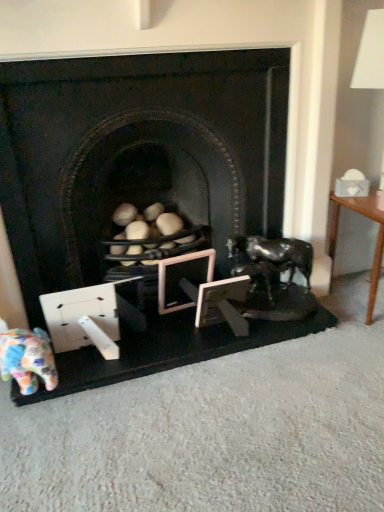
Question: From the image's perspective, is wooden picture frame at center, the 1th picture frame in the left-to-right sequence, beneath multicolored fabric elephant at lower left?

Choices:
 (A) no
 (B) yes

Answer: (A)

Question: Can you confirm if wooden picture frame at center, marked as the 2th picture frame in a right-to-left arrangement, is wider than multicolored fabric elephant at lower left?

Choices:
 (A) yes
 (B) no

Answer: (B)

Question: From a real-world perspective, is wooden picture frame at center, the 1th picture frame in the left-to-right sequence, positioned under multicolored fabric elephant at lower left based on gravity?

Choices:
 (A) no
 (B) yes

Answer: (A)

Question: Can multicolored fabric elephant at lower left be found inside wooden picture frame at center, the 1th picture frame in the left-to-right sequence?

Choices:
 (A) no
 (B) yes

Answer: (A)

Question: From a real-world perspective, is wooden picture frame at center, the 1th picture frame in the left-to-right sequence, over multicolored fabric elephant at lower left?

Choices:
 (A) yes
 (B) no

Answer: (A)

Question: From the image's perspective, is wooden picture frame at center, arranged as the first picture frame when viewed from the right, located above or below multicolored fabric elephant at lower left?

Choices:
 (A) above
 (B) below

Answer: (A)

Question: Visually, is wooden picture frame at center, acting as the 2th picture frame starting from the left, positioned to the left or to the right of multicolored fabric elephant at lower left?

Choices:
 (A) left
 (B) right

Answer: (B)

Question: Would you say wooden picture frame at center, arranged as the first picture frame when viewed from the right, is inside or outside multicolored fabric elephant at lower left?

Choices:
 (A) outside
 (B) inside

Answer: (A)

Question: From a real-world perspective, is wooden picture frame at center, acting as the 2th picture frame starting from the left, physically located above or below multicolored fabric elephant at lower left?

Choices:
 (A) below
 (B) above

Answer: (B)

Question: Is wooden picture frame at center, arranged as the first picture frame when viewed from the right, situated inside shiny black horse at right or outside?

Choices:
 (A) inside
 (B) outside

Answer: (B)

Question: Is wooden picture frame at center, acting as the 2th picture frame starting from the left, wider or thinner than shiny black horse at right?

Choices:
 (A) wide
 (B) thin

Answer: (B)

Question: From a real-world perspective, is wooden picture frame at center, arranged as the first picture frame when viewed from the right, positioned above or below shiny black horse at right?

Choices:
 (A) below
 (B) above

Answer: (A)

Question: Does point (226, 302) appear closer or farther from the camera than point (274, 245)?

Choices:
 (A) closer
 (B) farther

Answer: (A)

Question: In the image, is shiny black horse at right positioned in front of or behind matte black fireplace at center?

Choices:
 (A) behind
 (B) front

Answer: (A)

Question: Is point (278, 265) positioned closer to the camera than point (6, 73)?

Choices:
 (A) farther
 (B) closer

Answer: (A)